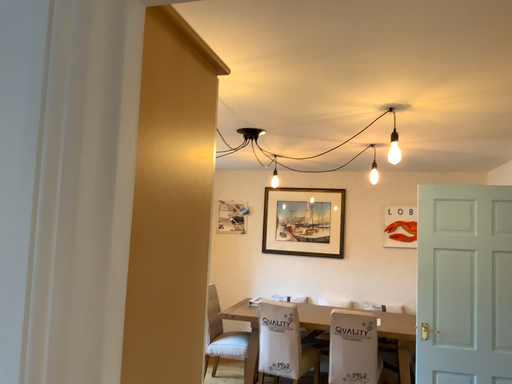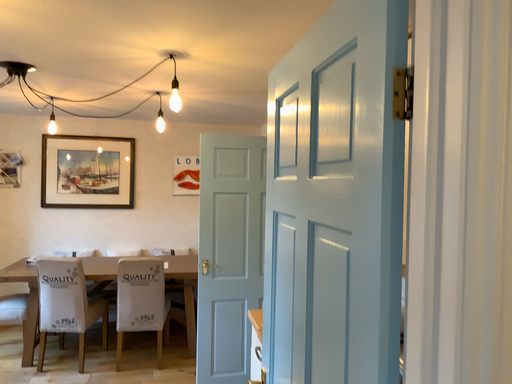
Question: Which way did the camera rotate in the video?

Choices:
 (A) rotated upward
 (B) rotated downward

Answer: (B)